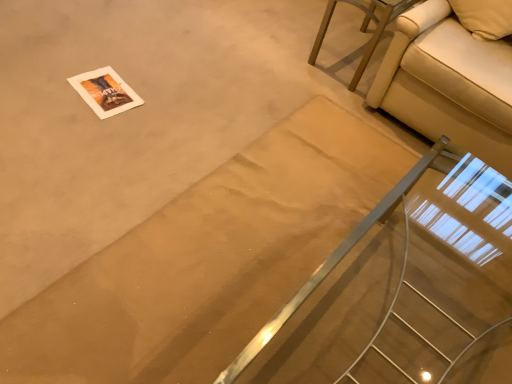
Question: From the image's perspective, is clear glass stairs at center on top of beige fabric couch at upper right?

Choices:
 (A) no
 (B) yes

Answer: (A)

Question: Does clear glass stairs at center have a smaller size compared to beige fabric couch at upper right?

Choices:
 (A) yes
 (B) no

Answer: (A)

Question: Is clear glass stairs at center beside beige fabric couch at upper right?

Choices:
 (A) no
 (B) yes

Answer: (A)

Question: From the image's perspective, would you say clear glass stairs at center is shown under beige fabric couch at upper right?

Choices:
 (A) no
 (B) yes

Answer: (B)

Question: From a real-world perspective, is clear glass stairs at center under beige fabric couch at upper right?

Choices:
 (A) yes
 (B) no

Answer: (A)

Question: From a real-world perspective, is clear glass stairs at center positioned above or below beige fabric couch at upper right?

Choices:
 (A) above
 (B) below

Answer: (B)

Question: In terms of height, does clear glass stairs at center look taller or shorter compared to beige fabric couch at upper right?

Choices:
 (A) short
 (B) tall

Answer: (A)

Question: Based on their sizes in the image, would you say clear glass stairs at center is bigger or smaller than beige fabric couch at upper right?

Choices:
 (A) small
 (B) big

Answer: (A)

Question: Is point (270, 360) positioned closer to the camera than point (464, 99)?

Choices:
 (A) closer
 (B) farther

Answer: (A)

Question: In terms of height, does beige fabric couch at upper right look taller or shorter compared to clear glass stairs at center?

Choices:
 (A) tall
 (B) short

Answer: (A)

Question: In terms of width, does beige fabric couch at upper right look wider or thinner when compared to clear glass stairs at center?

Choices:
 (A) thin
 (B) wide

Answer: (B)

Question: From the image's perspective, is beige fabric couch at upper right located above or below clear glass stairs at center?

Choices:
 (A) below
 (B) above

Answer: (B)

Question: Do you think beige fabric couch at upper right is within clear glass stairs at center, or outside of it?

Choices:
 (A) outside
 (B) inside

Answer: (A)

Question: From a real-world perspective, is clear glass stairs at center positioned above or below beige fabric couch at upper right?

Choices:
 (A) below
 (B) above

Answer: (B)

Question: In terms of height, does clear glass stairs at center look taller or shorter compared to beige fabric couch at upper right?

Choices:
 (A) tall
 (B) short

Answer: (A)